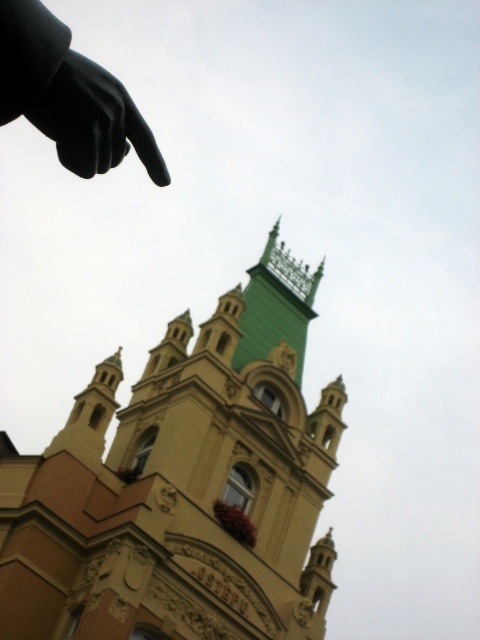
Question: Which of the following is the closest to the observer?

Choices:
 (A) 301,499
 (B) 109,77

Answer: (B)

Question: Considering the relative positions of beige stone church at center and black matte hand at upper left in the image provided, where is beige stone church at center located with respect to black matte hand at upper left?

Choices:
 (A) left
 (B) right

Answer: (B)

Question: Is beige stone church at center to the left of black matte hand at upper left from the viewer's perspective?

Choices:
 (A) no
 (B) yes

Answer: (A)

Question: Does beige stone church at center have a lesser width compared to black matte hand at upper left?

Choices:
 (A) yes
 (B) no

Answer: (B)

Question: Which point is farther from the camera taking this photo?

Choices:
 (A) (313, 556)
 (B) (137, 138)

Answer: (A)

Question: Which point appears farthest from the camera in this image?

Choices:
 (A) (160, 568)
 (B) (151, 152)

Answer: (A)